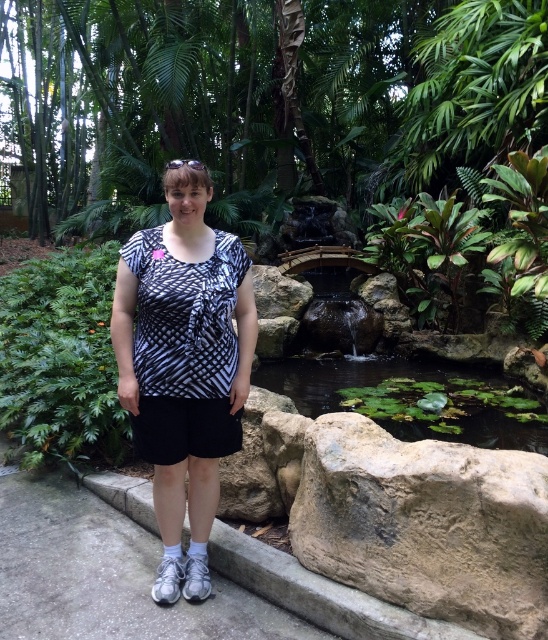
In the scene shown: Can you confirm if brown rough rock at center is thinner than green leafy plant at lower right?

Indeed, brown rough rock at center has a lesser width compared to green leafy plant at lower right.

Measure the distance between point (265,508) and camera.

Point (265,508) is 2.43 meters away from camera.

Is point (243, 460) positioned behind point (482, 384)?

No.

Where is `brown rough rock at center`? The width and height of the screenshot is (548, 640). brown rough rock at center is located at coordinates (264, 460).

Can you confirm if green leafy pond at center is taller than black cotton shorts at center?

Indeed, green leafy pond at center has a greater height compared to black cotton shorts at center.

Does green leafy pond at center appear under black cotton shorts at center?

Indeed, green leafy pond at center is positioned under black cotton shorts at center.

This screenshot has width=548, height=640. I want to click on green leafy pond at center, so click(x=406, y=397).

Is green leafy plant at lower right closer to camera compared to black cotton shorts at center?

No, it is not.

Looking at this image, measure the distance between point (415, 394) and camera.

4.35 meters

Is point (449, 422) farther from viewer compared to point (197, 448)?

That is True.

Find the location of `green leafy plant at lower right`. green leafy plant at lower right is located at coordinates (439, 401).